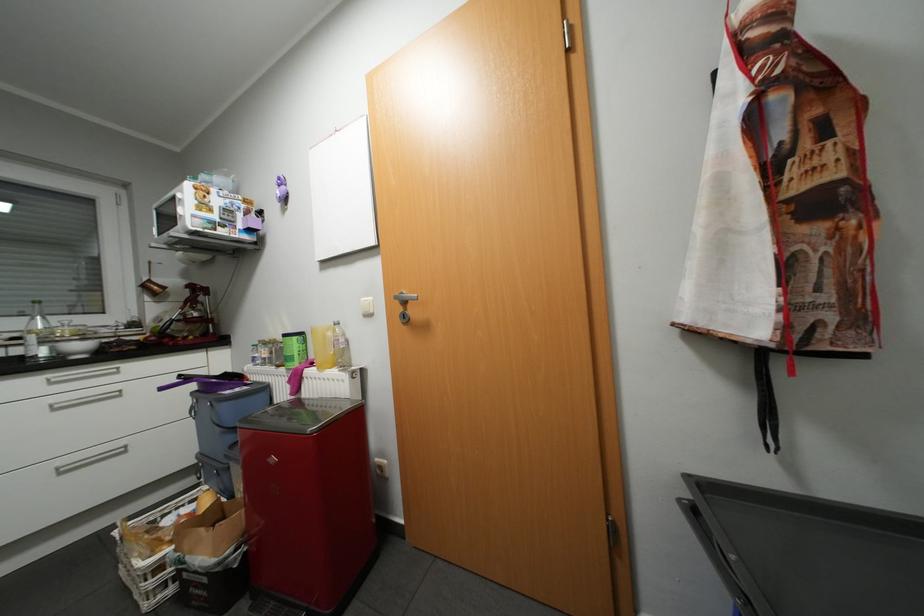
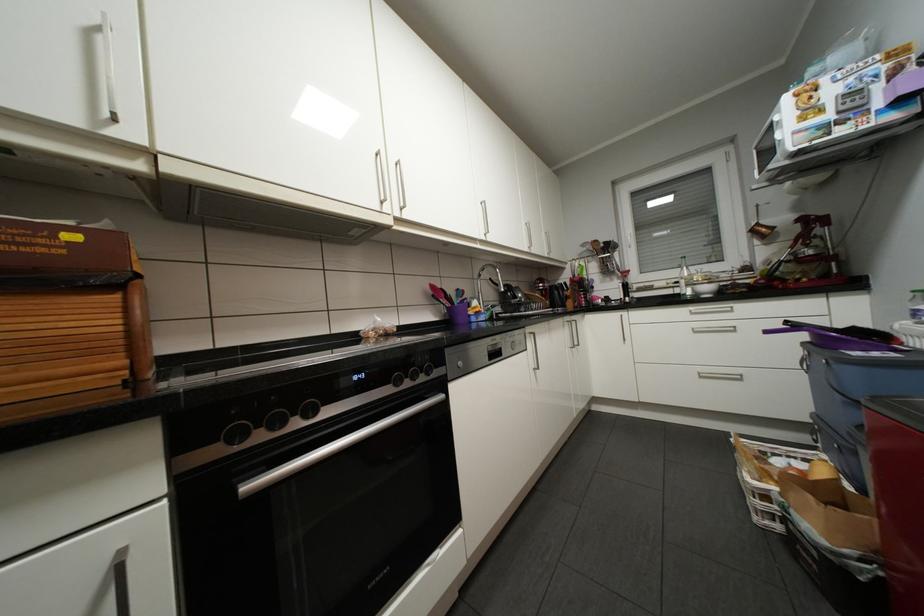
Locate, in the second image, the point that corresponds to [61,382] in the first image.

(699, 313)